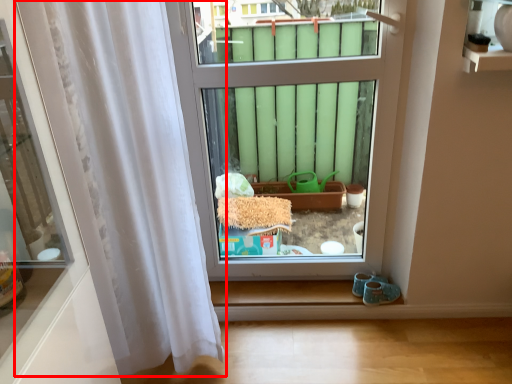
Question: Considering the relative positions of curtain (annotated by the red box) and window in the image provided, where is curtain (annotated by the red box) located with respect to the staircase?

Choices:
 (A) left
 (B) right

Answer: (A)